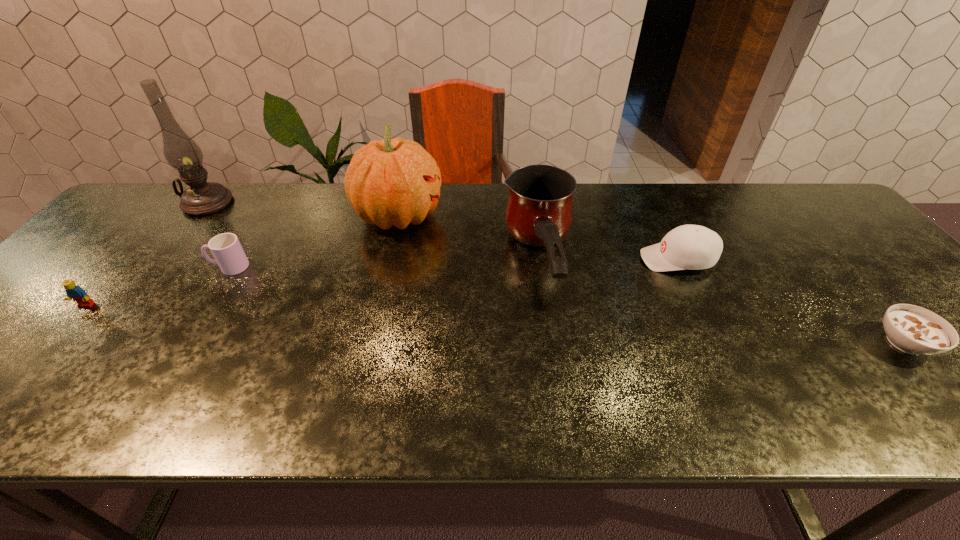
Identify the location of free space at the left edge of the desktop. (11, 359).

The height and width of the screenshot is (540, 960). I want to click on vacant space at the right edge of the desktop, so click(x=956, y=356).

Where is `vacant space at the far right corner of the desktop`? The height and width of the screenshot is (540, 960). vacant space at the far right corner of the desktop is located at coordinates (790, 221).

Locate an element on the screen. free space between the rightmost object and the sixth object from left to right is located at coordinates (791, 301).

Locate an element on the screen. This screenshot has width=960, height=540. free spot between the fifth object from right to left and the tallest object is located at coordinates (218, 235).

This screenshot has height=540, width=960. Identify the location of vacant point located between the oil lamp and the Lego. (147, 254).

Find the location of a particular element. Image resolution: width=960 pixels, height=540 pixels. vacant area that lies between the Lego and the shortest object is located at coordinates (495, 324).

Locate an element on the screen. This screenshot has width=960, height=540. free space between the third object from left to right and the Lego is located at coordinates (157, 286).

What are the coordinates of `vacant space in between the fifth shortest object and the oil lamp` in the screenshot? It's located at (373, 234).

Find the location of a particular element. empty space that is in between the soup bowl and the second tallest object is located at coordinates (652, 279).